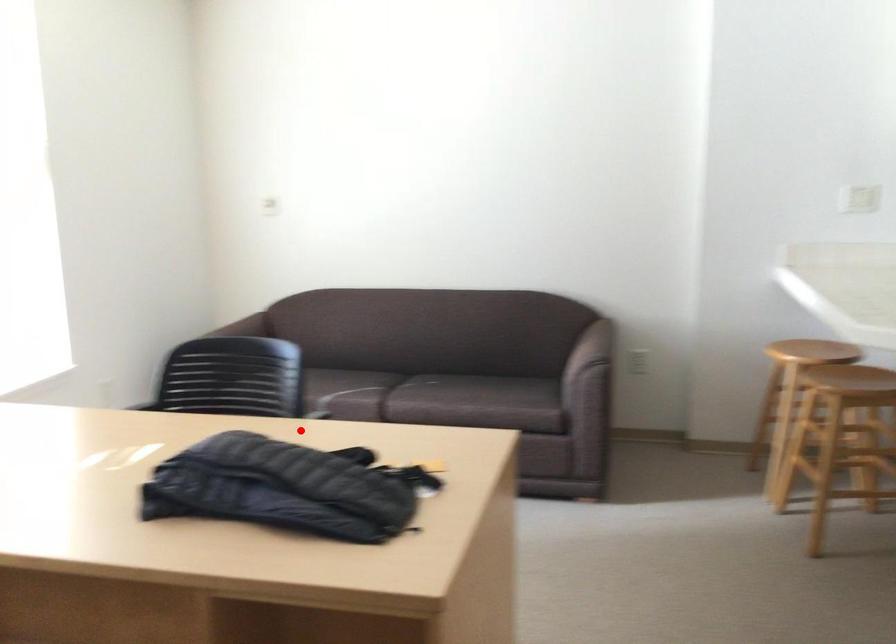
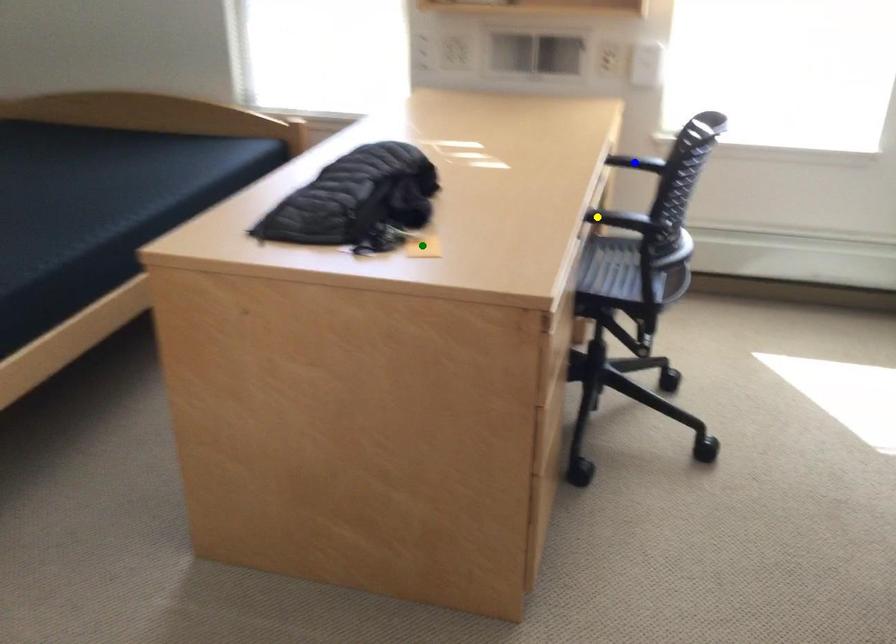
Question: I am providing you with two images of the same scene from different viewpoints. A red point is marked on the first image. You are given multiple points on the second image. Can you choose the point in image 2 that corresponds to the point in image 1?

Choices:
 (A) yellow point
 (B) blue point
 (C) green point

Answer: (A)